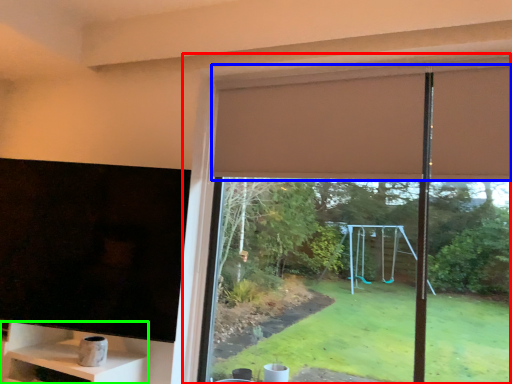
Question: Considering the real-world distances, which object is farthest from window (highlighted by a red box)? curtain (highlighted by a blue box) or shelf (highlighted by a green box)?

Choices:
 (A) curtain
 (B) shelf

Answer: (B)